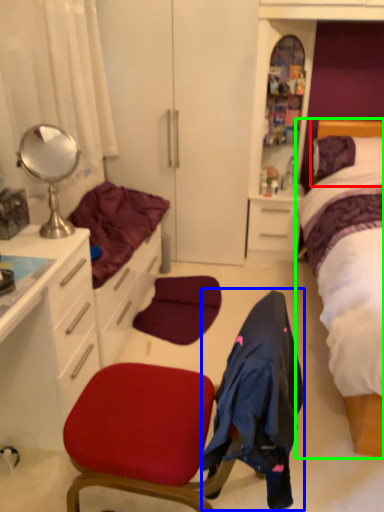
Question: Which object is positioned closest to headboard (highlighted by a red box)? Select from clothing (highlighted by a blue box) and bed (highlighted by a green box).

Choices:
 (A) clothing
 (B) bed

Answer: (B)